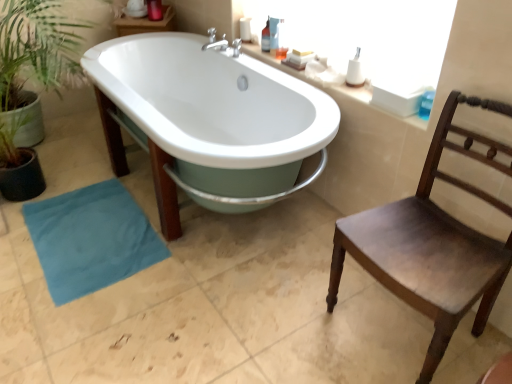
Locate an element on the screen. This screenshot has height=384, width=512. translucent plastic bottle at upper right, the 1th toiletry in the top-to-bottom sequence is located at coordinates pyautogui.click(x=265, y=38).

What do you see at coordinates (216, 116) in the screenshot? I see `white glossy bathtub at center` at bounding box center [216, 116].

Where is `dark wood chair at right`? This screenshot has width=512, height=384. dark wood chair at right is located at coordinates (432, 242).

Find the location of a particular element. The width and height of the screenshot is (512, 384). white plastic toothbrush at upper right, the 2th toiletry viewed from the top is located at coordinates tap(355, 71).

You are a GUI agent. You are given a task and a screenshot of the screen. Output one action in this format:
    pyautogui.click(x=<x>, y=<y>)
    Task: Click on the teal fabric towel at lower left
    
    Given the screenshot: What is the action you would take?
    pyautogui.click(x=91, y=239)

Is dark wood chair at right aimed at white plastic toothbrush at upper right, which ranks as the 1th toiletry in front-to-back order?

No, dark wood chair at right is not oriented towards white plastic toothbrush at upper right, which ranks as the 1th toiletry in front-to-back order.

Based on the photo, considering the relative positions of dark wood chair at right and white plastic toothbrush at upper right, the 2th toiletry positioned from the left, in the image provided, is dark wood chair at right to the left of white plastic toothbrush at upper right, the 2th toiletry positioned from the left, from the viewer's perspective?

In fact, dark wood chair at right is to the right of white plastic toothbrush at upper right, the 2th toiletry positioned from the left.

Is dark wood chair at right closer to camera compared to white plastic toothbrush at upper right, positioned as the 1th toiletry in bottom-to-top order?

Yes, the depth of dark wood chair at right is less than that of white plastic toothbrush at upper right, positioned as the 1th toiletry in bottom-to-top order.

Would you say white plastic toothbrush at upper right, which is the 1th toiletry from right to left, is part of dark wood chair at right's contents?

No, white plastic toothbrush at upper right, which is the 1th toiletry from right to left, is not inside dark wood chair at right.

Considering the relative sizes of teal fabric towel at lower left and green leafy plant at left in the image provided, is teal fabric towel at lower left taller than green leafy plant at left?

No.

This screenshot has width=512, height=384. I want to click on vegetation positioned vertically above the teal fabric towel at lower left (from a real-world perspective), so click(37, 49).

Can you confirm if teal fabric towel at lower left is thinner than green leafy plant at left?

Indeed, teal fabric towel at lower left has a lesser width compared to green leafy plant at left.

From a real-world perspective, is teal fabric towel at lower left over green leafy plant at left?

No, from a real-world perspective, teal fabric towel at lower left is not over green leafy plant at left

Which object is closer to the camera, white glossy counter top at upper center or green leafy plant at left?

Positioned in front is green leafy plant at left.

From the image's perspective, would you say white glossy counter top at upper center is shown under green leafy plant at left?

Incorrect, from the image's perspective, white glossy counter top at upper center is higher than green leafy plant at left.

In the scene shown: Is green leafy plant at left at the back of white glossy counter top at upper center?

That's not correct — white glossy counter top at upper center is not looking away from green leafy plant at left.

How different are the orientations of white glossy counter top at upper center and green leafy plant at left in degrees?

The facing directions of white glossy counter top at upper center and green leafy plant at left are 88 degrees apart.

From the image's perspective, is white glossy counter top at upper center positioned above or below translucent plastic bottle at upper right, the 1th toiletry in the top-to-bottom sequence?

Clearly, from the image's perspective, white glossy counter top at upper center is below translucent plastic bottle at upper right, the 1th toiletry in the top-to-bottom sequence.

From a real-world perspective, who is located higher, white glossy counter top at upper center or translucent plastic bottle at upper right, the 1th toiletry in the top-to-bottom sequence?

From a 3D spatial view, translucent plastic bottle at upper right, the 1th toiletry in the top-to-bottom sequence, is above.

Can you confirm if white glossy counter top at upper center is thinner than translucent plastic bottle at upper right, the 2th toiletry in the bottom-to-top sequence?

In fact, white glossy counter top at upper center might be wider than translucent plastic bottle at upper right, the 2th toiletry in the bottom-to-top sequence.

Considering the positions of objects white glossy counter top at upper center and translucent plastic bottle at upper right, marked as the 1th toiletry in a left-to-right arrangement, in the image provided, who is more to the right, white glossy counter top at upper center or translucent plastic bottle at upper right, marked as the 1th toiletry in a left-to-right arrangement,?

Positioned to the right is white glossy counter top at upper center.

Considering the relative sizes of teal fabric towel at lower left and translucent plastic bottle at upper right, which is counted as the first toiletry, starting from the back, in the image provided, is teal fabric towel at lower left taller than translucent plastic bottle at upper right, which is counted as the first toiletry, starting from the back,?

No.

Is teal fabric towel at lower left oriented towards translucent plastic bottle at upper right, which is counted as the first toiletry, starting from the back?

No, teal fabric towel at lower left is not aimed at translucent plastic bottle at upper right, which is counted as the first toiletry, starting from the back.

Is point (24, 211) less distant than point (266, 26)?

Yes, point (24, 211) is in front of point (266, 26).

From a real-world perspective, is teal fabric towel at lower left physically located above or below translucent plastic bottle at upper right, the second toiletry viewed from the front?

From a real-world perspective, teal fabric towel at lower left is physically below translucent plastic bottle at upper right, the second toiletry viewed from the front.

How different are the orientations of dark wood chair at right and white glossy bathtub at center in degrees?

They differ by 8.4e-05 degrees in their facing directions.

From the image's perspective, does dark wood chair at right appear lower than white glossy bathtub at center?

Correct, dark wood chair at right appears lower than white glossy bathtub at center in the image.

Would you say dark wood chair at right is outside white glossy bathtub at center?

dark wood chair at right is positioned outside white glossy bathtub at center.

Is dark wood chair at right looking in the opposite direction of white glossy bathtub at center?

No, white glossy bathtub at center is not at the back of dark wood chair at right.

Is point (311, 143) behind point (354, 68)?

No.

From the image's perspective, which one is positioned higher, white glossy bathtub at center or white plastic toothbrush at upper right, which ranks as the 1th toiletry in front-to-back order?

white plastic toothbrush at upper right, which ranks as the 1th toiletry in front-to-back order.

Which of these two, white glossy bathtub at center or white plastic toothbrush at upper right, which is the 1th toiletry from right to left, is thinner?

white plastic toothbrush at upper right, which is the 1th toiletry from right to left, is thinner.

Is white glossy bathtub at center oriented away from white plastic toothbrush at upper right, the 2th toiletry positioned from the left?

Yes, white glossy bathtub at center is positioned with its back facing white plastic toothbrush at upper right, the 2th toiletry positioned from the left.

Where is `toiletry that is the 1st one when counting leftward from the dark wood chair at right`? toiletry that is the 1st one when counting leftward from the dark wood chair at right is located at coordinates (355, 71).

Locate an element on the screen. beach towel behind the green leafy plant at left is located at coordinates (91, 239).

Looking at the image, which one is located further to white plastic toothbrush at upper right, which ranks as the 1th toiletry in front-to-back order, translucent plastic bottle at upper right, the 2th toiletry in the right-to-left sequence, or dark wood chair at right?

Based on the image, dark wood chair at right appears to be further to white plastic toothbrush at upper right, which ranks as the 1th toiletry in front-to-back order.

From the image, which object appears to be farther from white plastic toothbrush at upper right, the 2th toiletry viewed from the top, teal fabric towel at lower left or white glossy bathtub at center?

teal fabric towel at lower left is positioned further to the anchor white plastic toothbrush at upper right, the 2th toiletry viewed from the top.

Based on their spatial positions, is white glossy bathtub at center or teal fabric towel at lower left closer to dark wood chair at right?

white glossy bathtub at center.

Based on their spatial positions, is green leafy plant at left or teal fabric towel at lower left further from white glossy bathtub at center?

The object further to white glossy bathtub at center is teal fabric towel at lower left.

Which object lies nearer to the anchor point white plastic toothbrush at upper right, positioned as the 1th toiletry in bottom-to-top order, white glossy counter top at upper center or green leafy plant at left?

white glossy counter top at upper center is positioned closer to the anchor white plastic toothbrush at upper right, positioned as the 1th toiletry in bottom-to-top order.

Estimate the real-world distances between objects in this image. Which object is closer to teal fabric towel at lower left, white glossy counter top at upper center or translucent plastic bottle at upper right, the second toiletry viewed from the front?

Based on the image, white glossy counter top at upper center appears to be nearer to teal fabric towel at lower left.

Based on their spatial positions, is white glossy counter top at upper center or teal fabric towel at lower left further from dark wood chair at right?

teal fabric towel at lower left lies further to dark wood chair at right than the other object.

Based on their spatial positions, is green leafy plant at left or translucent plastic bottle at upper right, the 2th toiletry in the bottom-to-top sequence, further from white plastic toothbrush at upper right, the 2th toiletry positioned from the left?

The object further to white plastic toothbrush at upper right, the 2th toiletry positioned from the left, is green leafy plant at left.

This screenshot has width=512, height=384. I want to click on toiletry between teal fabric towel at lower left and white glossy counter top at upper center, so click(265, 38).

Where is `toiletry between white glossy counter top at upper center and translucent plastic bottle at upper right, the 1th toiletry in the top-to-bottom sequence, from front to back`? This screenshot has height=384, width=512. toiletry between white glossy counter top at upper center and translucent plastic bottle at upper right, the 1th toiletry in the top-to-bottom sequence, from front to back is located at coordinates (355, 71).

In order to click on bathtub positioned between dark wood chair at right and translucent plastic bottle at upper right, the 2th toiletry in the bottom-to-top sequence, from near to far in this screenshot , I will do `click(216, 116)`.

The image size is (512, 384). Find the location of `beach towel located between green leafy plant at left and dark wood chair at right in the left-right direction`. beach towel located between green leafy plant at left and dark wood chair at right in the left-right direction is located at coordinates tap(91, 239).